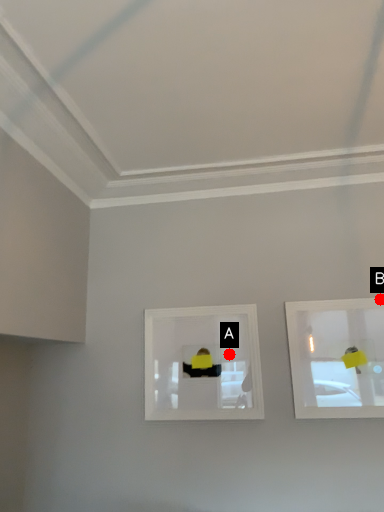
Question: Two points are circled on the image, labeled by A and B beside each circle. Which point is closer to the camera?

Choices:
 (A) A is closer
 (B) B is closer

Answer: (B)